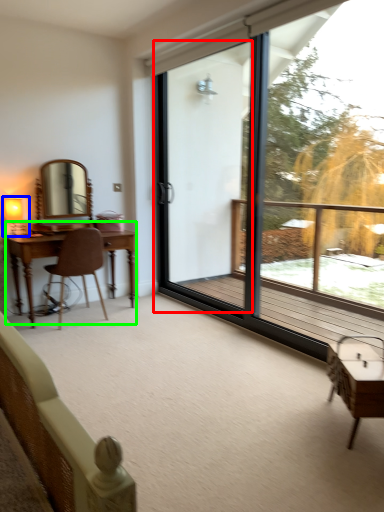
Question: Which object is positioned closest to screen door (highlighted by a red box)? Select from table lamp (highlighted by a blue box) and table (highlighted by a green box).

Choices:
 (A) table lamp
 (B) table

Answer: (B)